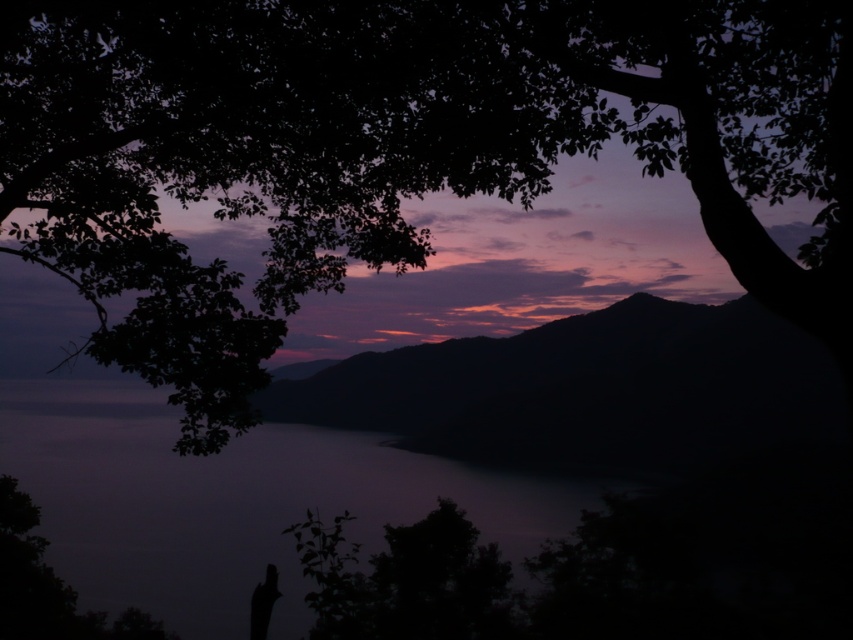
Is smooth water at center positioned in front of silhouette figure at lower left?

No, it is not.

This screenshot has width=853, height=640. What do you see at coordinates (235, 502) in the screenshot?
I see `smooth water at center` at bounding box center [235, 502].

I want to click on smooth water at center, so click(235, 502).

Is dark leafy tree at upper left positioned in front of smooth water at center?

Yes, dark leafy tree at upper left is in front of smooth water at center.

Between point (733, 4) and point (39, 522), which one is positioned behind?

The point (39, 522) is behind.

Image resolution: width=853 pixels, height=640 pixels. I want to click on dark leafy tree at upper left, so click(395, 147).

Measure the distance between point (x=480, y=109) and camera.

Point (x=480, y=109) and camera are 8.74 meters apart.

Between point (761, 124) and point (254, 621), which one is positioned in front?

Positioned in front is point (254, 621).

Who is more forward, [146,310] or [254,627]?

Positioned in front is point [254,627].

Locate an element on the screen. Image resolution: width=853 pixels, height=640 pixels. dark leafy tree at upper left is located at coordinates (395, 147).